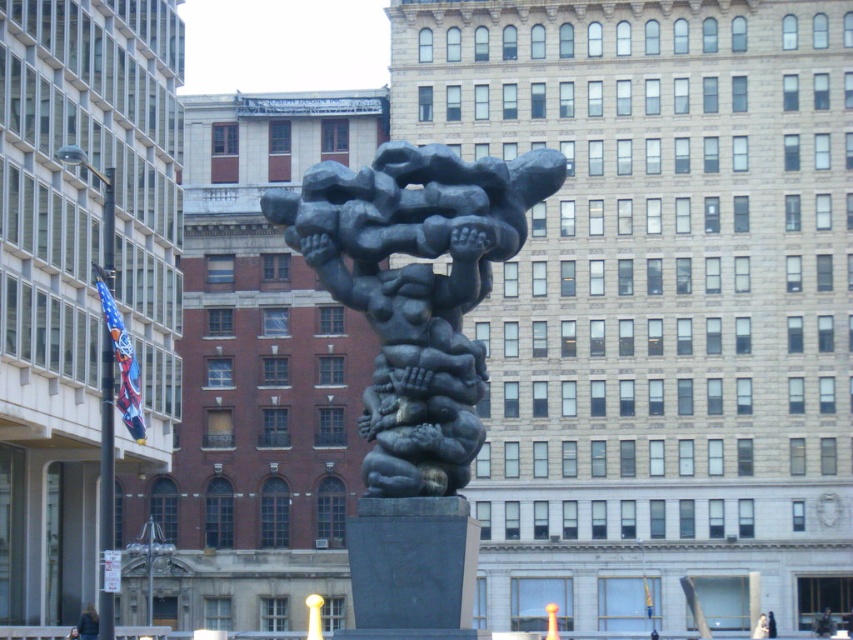
You are an artist planning to sketch the scene. You want to ensure the proportions between the bronze sculpture at center and the dark brown hair at lower left are accurate. Which object should you draw larger?

The bronze sculpture at center should be drawn larger because it has a greater height compared to the dark brown hair at lower left.

You are an art student standing in front of the bronze sculpture at center and the dark brown hair at lower left. Which object is positioned higher in the image?

The bronze sculpture at center is located above dark brown hair at lower left, so the bronze sculpture at center is positioned higher.

You are standing in an urban park and see the bronze sculpture at center. If you want to take a photo of it from a distance where it appears small but still recognizable, would standing 35 meters away be suitable?

The bronze sculpture at center is 34.88 meters from viewer, so standing 35 meters away would be slightly further than the sculpture is from the viewer. This distance would make the sculpture appear small but still recognizable in the photo.